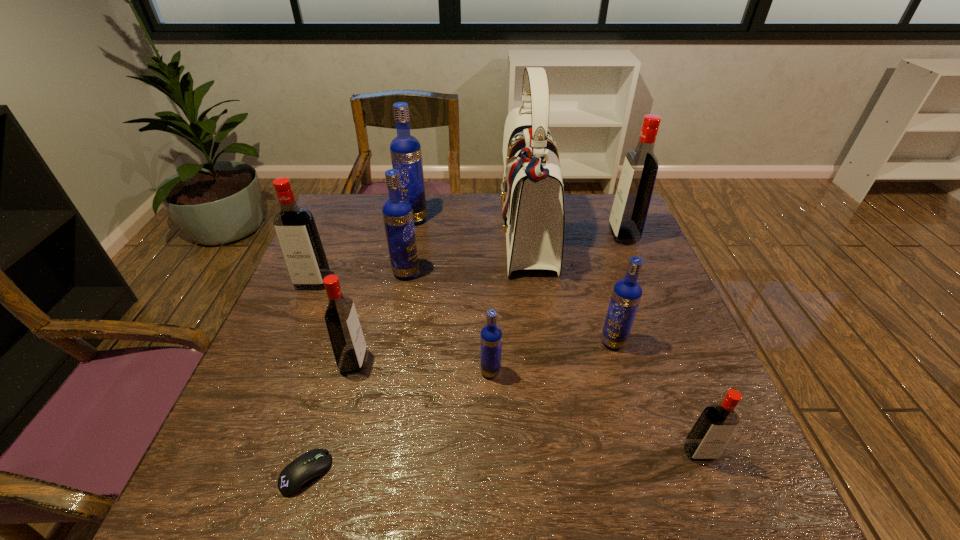
Where is `free space located on the front and back of the farthest red vodka`? The image size is (960, 540). free space located on the front and back of the farthest red vodka is located at coordinates (593, 235).

Find the location of `vacant space located 0.180m on the front and back of the farthest red vodka`. vacant space located 0.180m on the front and back of the farthest red vodka is located at coordinates (550, 235).

I want to click on free spot located 0.190m on the front and back of the farthest red vodka, so click(547, 235).

The height and width of the screenshot is (540, 960). Identify the location of vacant area situated 0.230m on the left of the biggest blue vodka. (326, 219).

Where is `vacant space located 0.240m on the right of the second biggest blue vodka`? The height and width of the screenshot is (540, 960). vacant space located 0.240m on the right of the second biggest blue vodka is located at coordinates (508, 273).

Find the location of `free space located 0.360m on the front and back of the leftmost red vodka`. free space located 0.360m on the front and back of the leftmost red vodka is located at coordinates (256, 415).

Locate an element on the screen. The width and height of the screenshot is (960, 540). vacant area located 0.350m on the back of the third vodka from right to left is located at coordinates (584, 244).

Identify the location of free space located on the front and back of the third red vodka from right to left. (470, 362).

I want to click on blank space located on the back of the fourth vodka from right to left, so click(490, 336).

At what (x,y) coordinates should I click in order to perform the action: click on blank area located 0.260m on the right of the computer equipment. Please return your answer as a coordinate pair (x, y). Looking at the image, I should click on (476, 472).